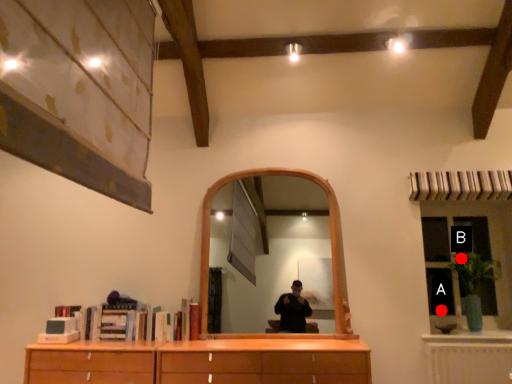
Question: Two points are circled on the image, labeled by A and B beside each circle. Which point appears farthest from the camera in this image?

Choices:
 (A) A is further
 (B) B is further

Answer: (A)